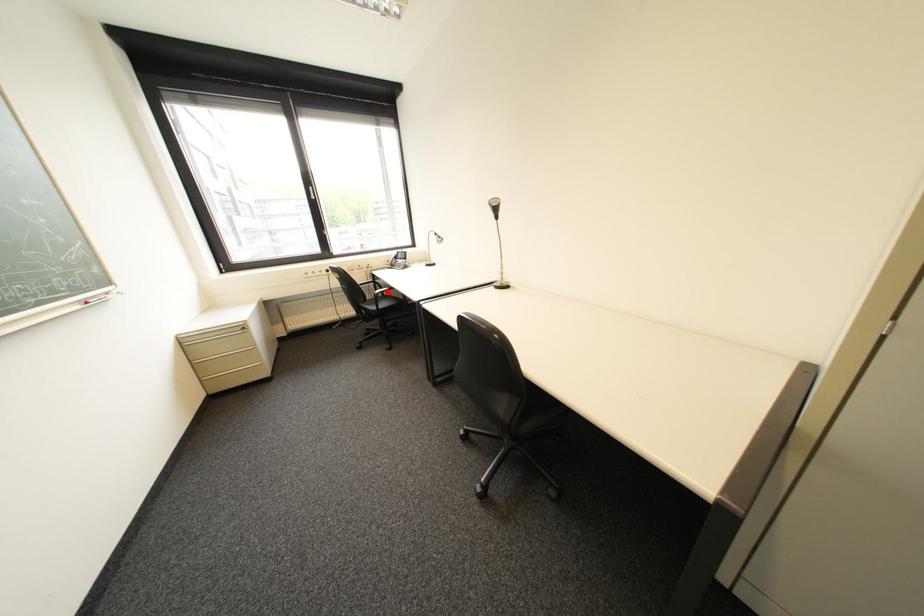
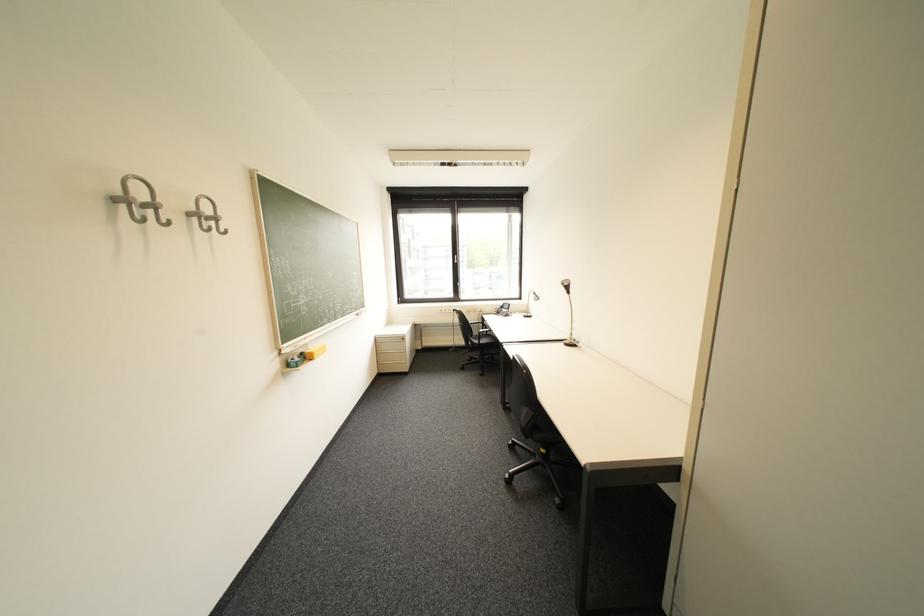
Where in the second image is the point corresponding to the highlighted location from the first image?

(492, 331)